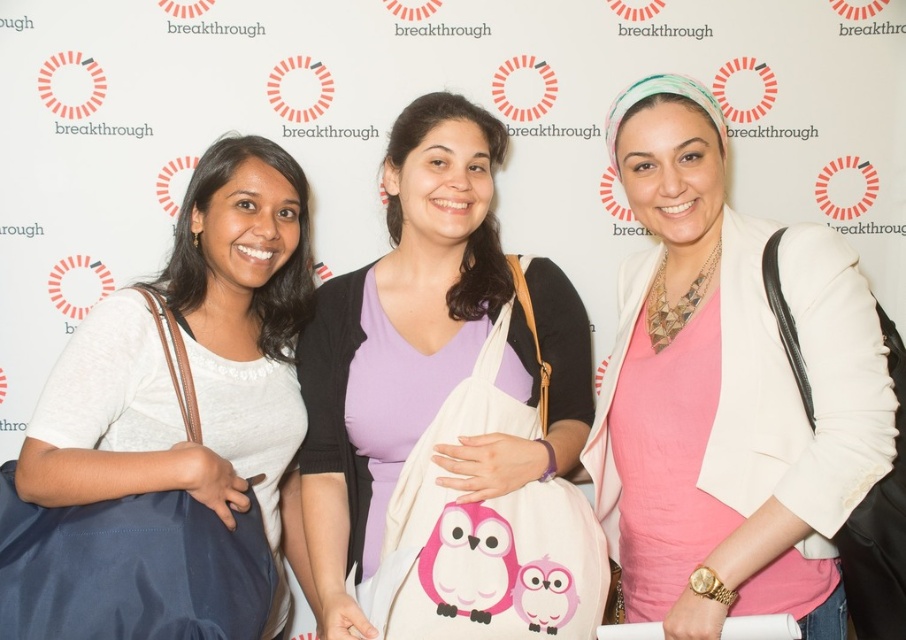
Does pink matte shirt at center appear on the left side of pink fabric bag at center?

No, pink matte shirt at center is not to the left of pink fabric bag at center.

Does pink matte shirt at center have a lesser width compared to pink fabric bag at center?

Yes, pink matte shirt at center is thinner than pink fabric bag at center.

Is point (678, 627) positioned in front of point (505, 349)?

Yes.

Where is `pink matte shirt at center`? The image size is (906, 640). pink matte shirt at center is located at coordinates (728, 392).

Between point (542, 342) and point (211, 216), which one is positioned in front?

Point (211, 216) is in front.

Who is higher up, pink fabric bag at center or matte white bag at left?

pink fabric bag at center is higher up.

Which is behind, point (338, 637) or point (228, 436)?

Positioned behind is point (228, 436).

Find the location of a particular element. The width and height of the screenshot is (906, 640). pink fabric bag at center is located at coordinates (430, 353).

The width and height of the screenshot is (906, 640). I want to click on pink matte shirt at center, so click(x=728, y=392).

Is point (792, 573) positioned after point (58, 388)?

No.

Locate an element on the screen. Image resolution: width=906 pixels, height=640 pixels. pink matte shirt at center is located at coordinates (728, 392).